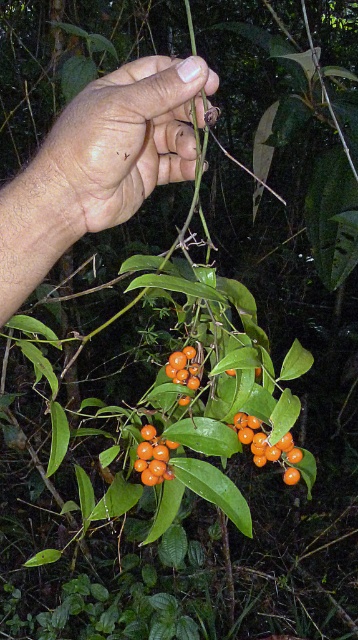
Is orange matte/soft berries at center to the right of orange matte fruit at center from the viewer's perspective?

In fact, orange matte/soft berries at center is to the left of orange matte fruit at center.

Based on the photo, who is more forward, (x=163, y=464) or (x=182, y=404)?

Point (x=163, y=464)

The height and width of the screenshot is (640, 358). In order to click on orange matte/soft berries at center in this screenshot , I will do `click(152, 458)`.

Does dry skin at center have a greater height compared to orange matte fruit at center?

Correct, dry skin at center is much taller as orange matte fruit at center.

Is dry skin at center shorter than orange matte fruit at center?

Incorrect, dry skin at center's height does not fall short of orange matte fruit at center's.

The image size is (358, 640). Describe the element at coordinates (123, 141) in the screenshot. I see `dry skin at center` at that location.

This screenshot has width=358, height=640. In order to click on dry skin at center in this screenshot , I will do `click(123, 141)`.

Is orange matte berries at center bigger than orange matte fruit at center?

Yes, orange matte berries at center is bigger than orange matte fruit at center.

Can you confirm if orange matte berries at center is positioned above orange matte fruit at center?

Incorrect, orange matte berries at center is not positioned above orange matte fruit at center.

Does point (253, 452) lie behind point (186, 346)?

No, it is in front of (186, 346).

Find the location of `orange matte berries at center`. orange matte berries at center is located at coordinates (267, 445).